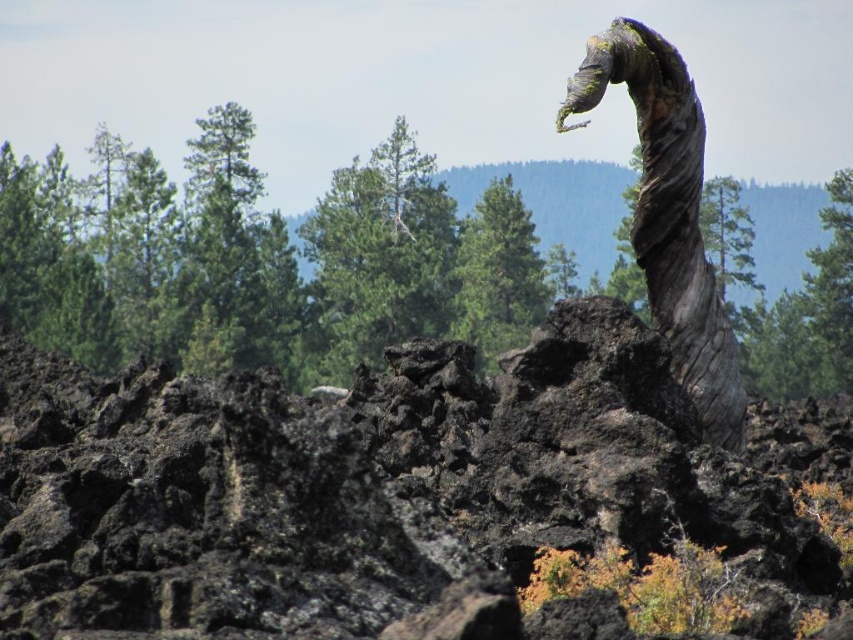
Question: Which point is closer to the camera?

Choices:
 (A) gray rough bark tree trunk at right
 (B) black volcanic rock at center

Answer: (B)

Question: Is the position of black volcanic rock at center more distant than that of gray rough bark tree trunk at right?

Choices:
 (A) yes
 (B) no

Answer: (B)

Question: Does black volcanic rock at center appear over gray rough bark tree trunk at right?

Choices:
 (A) yes
 (B) no

Answer: (B)

Question: Is black volcanic rock at center below gray rough bark tree trunk at right?

Choices:
 (A) yes
 (B) no

Answer: (A)